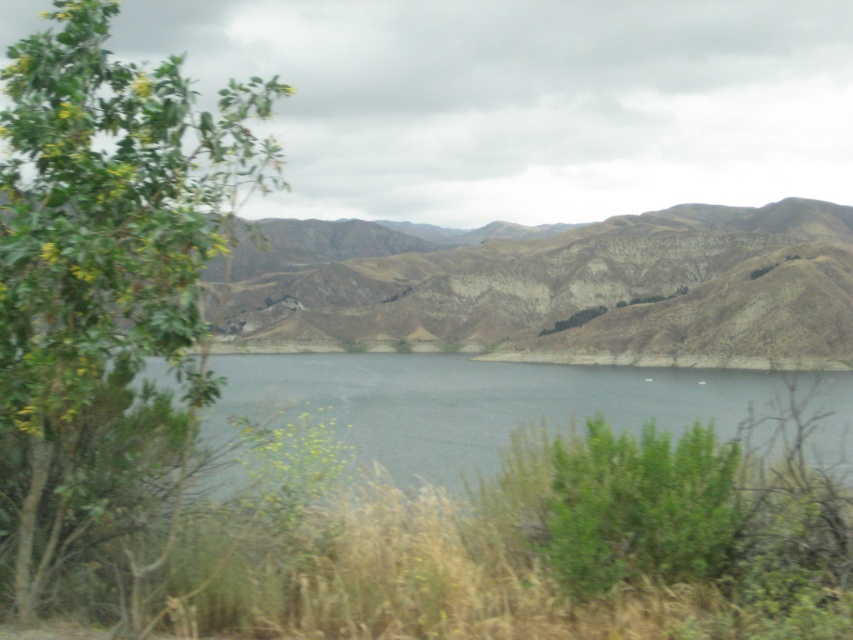
How distant is green leafy tree at left from clear water at center?

They are 14.78 meters apart.

Between point (90, 198) and point (482, 412), which one is positioned in front?

Positioned in front is point (90, 198).

This screenshot has width=853, height=640. Identify the location of green leafy tree at left. (103, 278).

The image size is (853, 640). What do you see at coordinates (561, 289) in the screenshot?
I see `brown textured mountain at center` at bounding box center [561, 289].

Is brown textured mountain at center bigger than clear water at center?

Indeed, brown textured mountain at center has a larger size compared to clear water at center.

In order to click on brown textured mountain at center in this screenshot , I will do tap(561, 289).

Identify the location of brown textured mountain at center. (561, 289).

Describe the element at coordinates (103, 278) in the screenshot. I see `green leafy tree at left` at that location.

Is green leafy tree at left above brown textured mountain at center?

No.

Image resolution: width=853 pixels, height=640 pixels. In order to click on green leafy tree at left in this screenshot , I will do `click(103, 278)`.